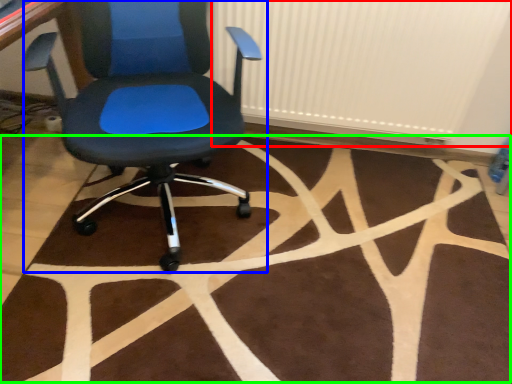
Question: Estimate the real-world distances between objects in this image. Which object is closer to radiator (highlighted by a red box), chair (highlighted by a blue box) or mat (highlighted by a green box)?

Choices:
 (A) chair
 (B) mat

Answer: (A)